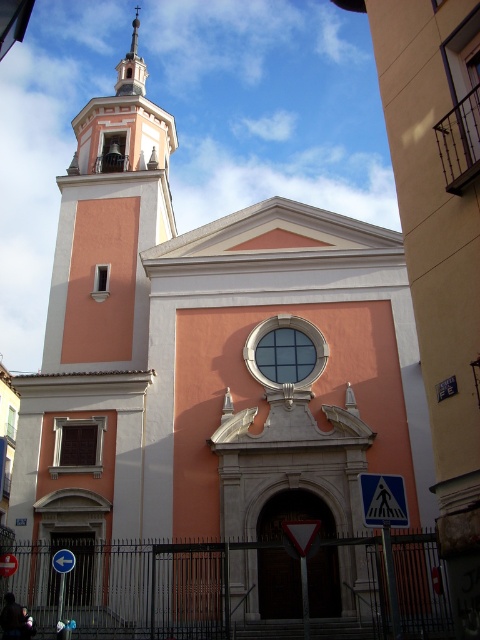
Question: Does smooth pink tower at upper left have a greater width compared to smooth white spire at upper center?

Choices:
 (A) no
 (B) yes

Answer: (B)

Question: Can you confirm if smooth pink tower at upper left is thinner than smooth white spire at upper center?

Choices:
 (A) no
 (B) yes

Answer: (A)

Question: Is smooth pink tower at upper left thinner than smooth white spire at upper center?

Choices:
 (A) no
 (B) yes

Answer: (A)

Question: Which point is farther to the camera?

Choices:
 (A) (134, 72)
 (B) (132, 40)

Answer: (B)

Question: Which object appears farthest from the camera in this image?

Choices:
 (A) smooth pink tower at upper left
 (B) smooth white spire at upper center

Answer: (B)

Question: Which point is farther from the camera taking this photo?

Choices:
 (A) (117, 67)
 (B) (122, 360)

Answer: (A)